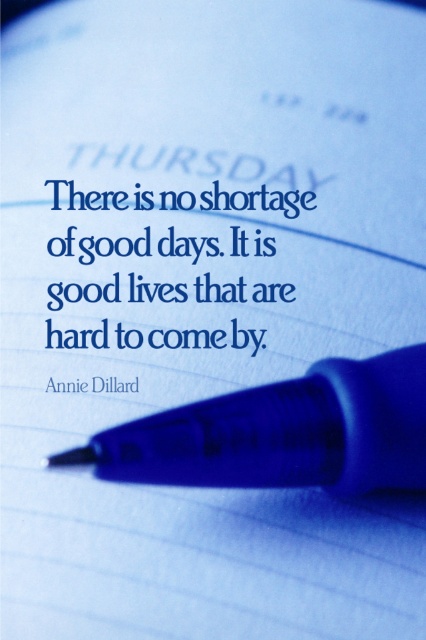
You are an artist trying to place a blue paper at center and a blue plastic pen at center on a shelf. If the shelf has a width of 10 cm, can both items fit side by side without overlapping?

The blue paper at center has a smaller width than the blue plastic pen at center. However, since the total width of both items combined is unknown, it is impossible to determine if they can fit on a 10 cm shelf without overlapping.

You are an artist who needs to place a 30 cm ruler between the blue paper at center and the blue plastic pen at center. Is there enough space for the ruler?

The blue paper at center is 32.86 centimeters from blue plastic pen at center. Since the ruler is 30 cm long, there is enough space to place it between them.

You are an artist who wants to draw the blue paper at center and the blue plastic pen at center in the scene. Which object should you draw first to ensure proper layering?

You should draw the blue paper at center first because the blue plastic pen at center is behind it, so the pen needs to be placed underneath the paper in the drawing.